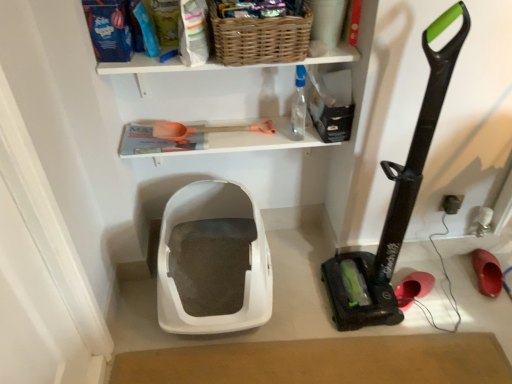
Find the location of a particular element. This screenshot has width=512, height=384. free space to the left of rubber matte shoe at lower right, the second footwear positioned from the left is located at coordinates (452, 274).